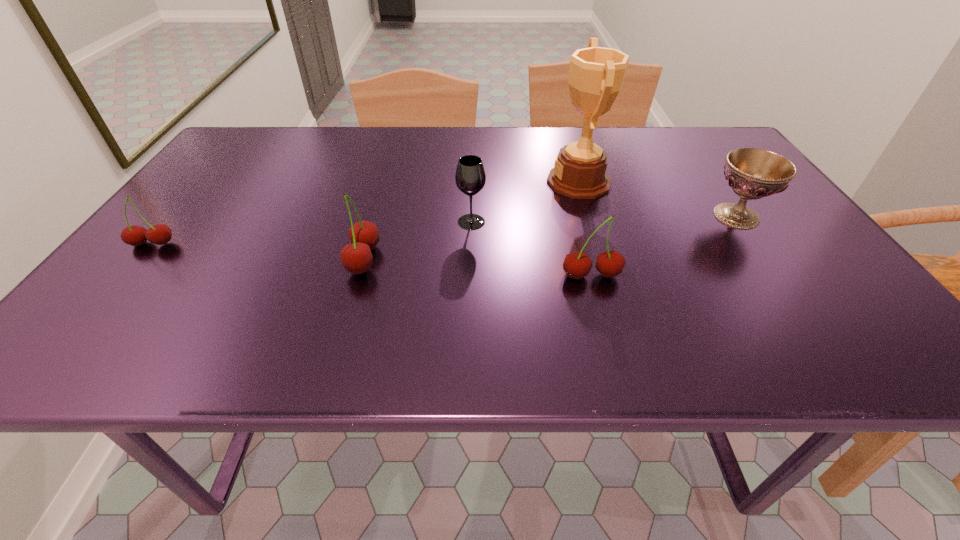
Please point a spot to add another cherry on the right. Please provide its 2D coordinates. Your answer should be formatted as a tuple, i.e. [(x, y)], where the tuple contains the x and y coordinates of a point satisfying the conditions above.

[(838, 294)]